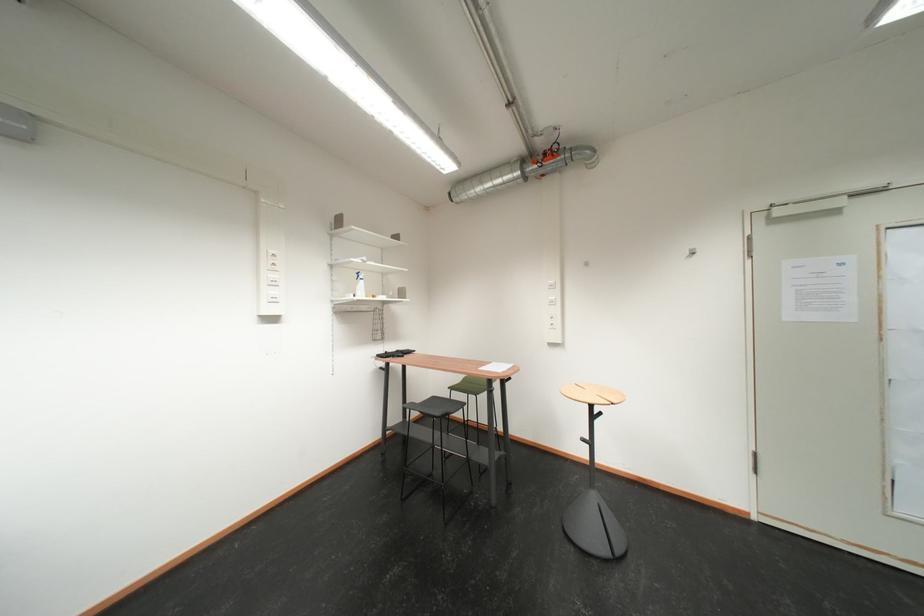
Describe the element at coordinates (435, 407) in the screenshot. The image size is (924, 616). I see `the chair sitting surface` at that location.